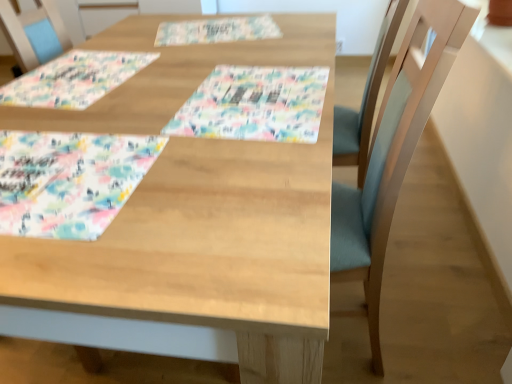
Question: Is pastel floral fabric placemat at lower left, which is the 1th place mat in front-to-back order, in contact with wooden table at center?

Choices:
 (A) yes
 (B) no

Answer: (B)

Question: Does pastel floral fabric placemat at lower left, the 3th place mat from the top, appear on the right side of wooden table at center?

Choices:
 (A) no
 (B) yes

Answer: (A)

Question: From a real-world perspective, is pastel floral fabric placemat at lower left, which is the 1th place mat in front-to-back order, positioned under wooden table at center based on gravity?

Choices:
 (A) no
 (B) yes

Answer: (A)

Question: Does pastel floral fabric placemat at lower left, the 3th place mat from the top, have a lesser height compared to wooden table at center?

Choices:
 (A) yes
 (B) no

Answer: (A)

Question: Considering the relative sizes of pastel floral fabric placemat at lower left, the 3th place mat from the top, and wooden table at center in the image provided, is pastel floral fabric placemat at lower left, the 3th place mat from the top, thinner than wooden table at center?

Choices:
 (A) no
 (B) yes

Answer: (B)

Question: From the image's perspective, is watercolor fabric placemat at center located above or below wooden table at center?

Choices:
 (A) above
 (B) below

Answer: (A)

Question: Is watercolor fabric placemat at center to the left or to the right of wooden table at center in the image?

Choices:
 (A) left
 (B) right

Answer: (B)

Question: From a real-world perspective, is watercolor fabric placemat at center positioned above or below wooden table at center?

Choices:
 (A) below
 (B) above

Answer: (B)

Question: Is watercolor fabric placemat at center inside the boundaries of wooden table at center, or outside?

Choices:
 (A) outside
 (B) inside

Answer: (B)

Question: In terms of height, does pastel floral fabric placemat at upper left, the second place mat in the bottom-to-top sequence, look taller or shorter compared to watercolor fabric placemat at center?

Choices:
 (A) short
 (B) tall

Answer: (B)

Question: In terms of size, does pastel floral fabric placemat at upper left, which ranks as the second place mat in back-to-front order, appear bigger or smaller than watercolor fabric placemat at center?

Choices:
 (A) small
 (B) big

Answer: (B)

Question: In the image, is pastel floral fabric placemat at upper left, which ranks as the second place mat in back-to-front order, positioned in front of or behind watercolor fabric placemat at center?

Choices:
 (A) behind
 (B) front

Answer: (A)

Question: Is pastel floral fabric placemat at upper left, acting as the 2th place mat starting from the front, spatially inside watercolor fabric placemat at center, or outside of it?

Choices:
 (A) inside
 (B) outside

Answer: (B)

Question: Is floral paper placemat at upper center, which is counted as the 1th place mat, starting from the back, bigger or smaller than watercolor fabric placemat at center?

Choices:
 (A) small
 (B) big

Answer: (A)

Question: Visually, is floral paper placemat at upper center, which is counted as the third place mat, starting from the front, positioned to the left or to the right of watercolor fabric placemat at center?

Choices:
 (A) left
 (B) right

Answer: (A)